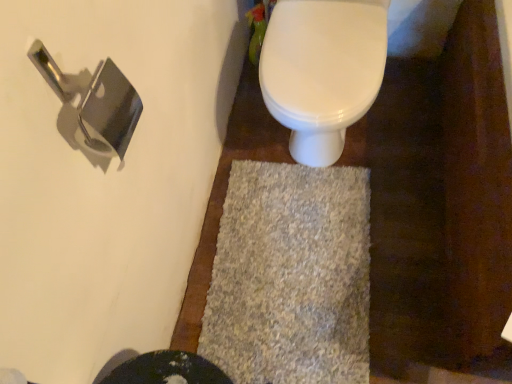
This screenshot has height=384, width=512. Identify the location of free space that is in between white glossy toilet at upper center and gray shaggy bath mat at center. (282, 156).